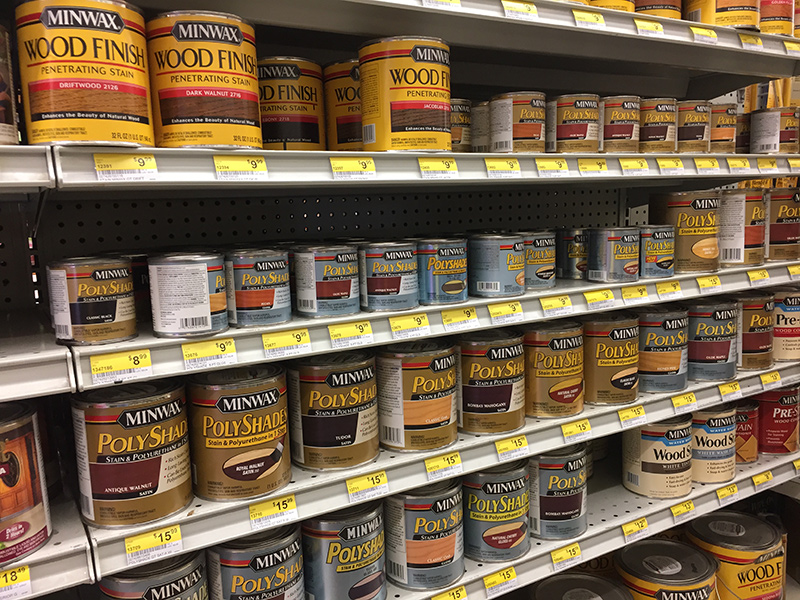
The width and height of the screenshot is (800, 600). Find the location of `price tags on bottom shelf`. price tags on bottom shelf is located at coordinates (502, 580), (458, 591), (572, 557), (636, 526), (682, 509), (728, 495), (765, 477).